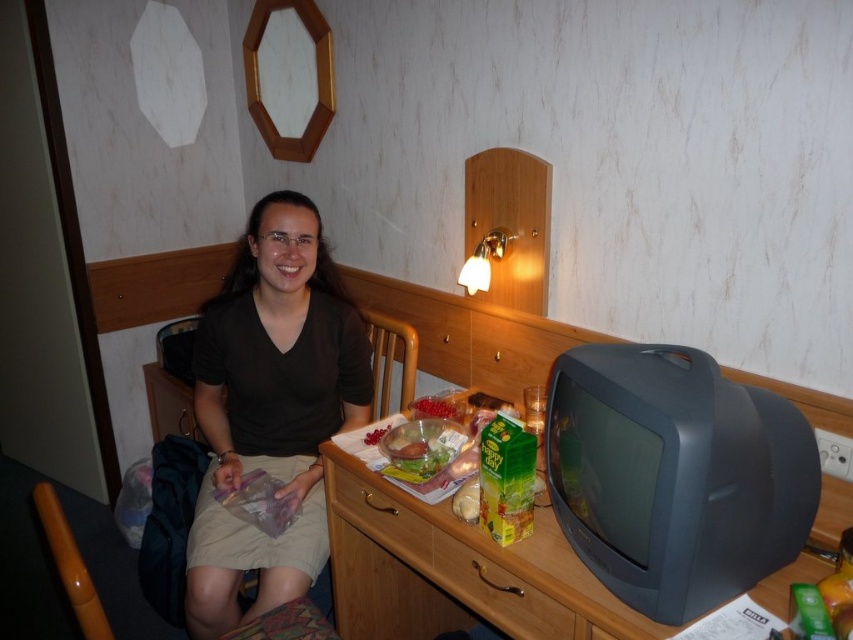
Question: Is wooden drawer at lower center above translucent plastic bag at center?

Choices:
 (A) no
 (B) yes

Answer: (A)

Question: Is matte black shirt at center behind translucent plastic bag at center?

Choices:
 (A) no
 (B) yes

Answer: (B)

Question: Which object is positioned closest to the wooden drawer at lower center?

Choices:
 (A) wooden drawer at center
 (B) wooden table at lower right
 (C) matte black shirt at center
 (D) translucent plastic bag at center

Answer: (B)

Question: Which of the following is the farthest from the observer?

Choices:
 (A) translucent plastic bag at center
 (B) wooden table at lower right
 (C) matte black shirt at center

Answer: (C)

Question: Among these points, which one is farthest from the camera?

Choices:
 (A) (322, 472)
 (B) (454, 456)
 (C) (419, 554)
 (D) (361, 490)

Answer: (A)

Question: Observing the image, what is the correct spatial positioning of matte black shirt at center in reference to wooden drawer at center?

Choices:
 (A) above
 (B) below

Answer: (A)